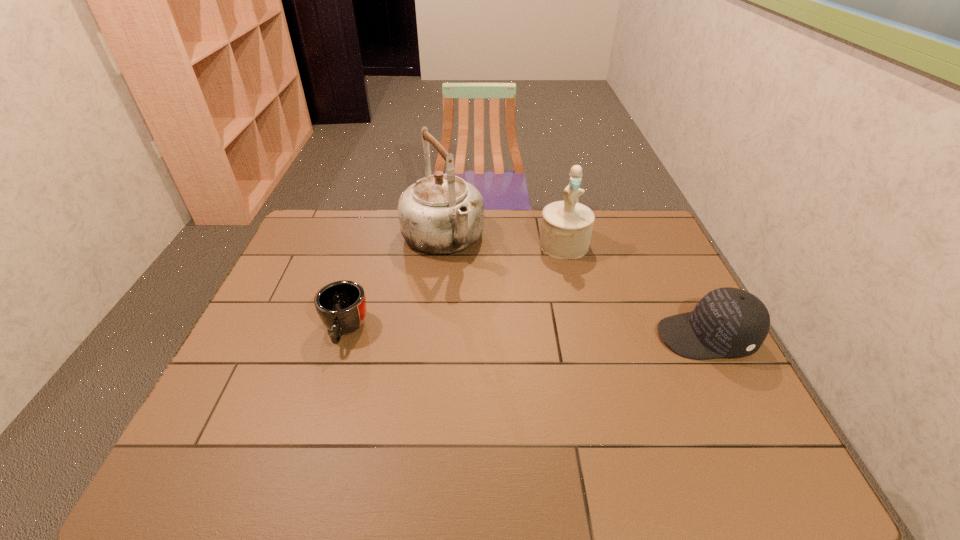
The height and width of the screenshot is (540, 960). Identify the location of vacant space that satisfies the following two spatial constraints: 1. on the side of the leftmost object with the handle; 2. at the front of the second shortest object where the brim is located. (343, 337).

At what (x,y) coordinates should I click in order to perform the action: click on free location that satisfies the following two spatial constraints: 1. on the front side of the second shortest object; 2. at the front of the third object from right to left where the brim is located. Please return your answer as a coordinate pair (x, y). Looking at the image, I should click on (432, 337).

You are a GUI agent. You are given a task and a screenshot of the screen. Output one action in this format:
    pyautogui.click(x=<x>, y=<y>)
    Task: Click on the vacant position in the image that satisfies the following two spatial constraints: 1. on the front side of the second shortest object; 2. at the front of the kettle where the brim is located
    
    Given the screenshot: What is the action you would take?
    pyautogui.click(x=432, y=337)